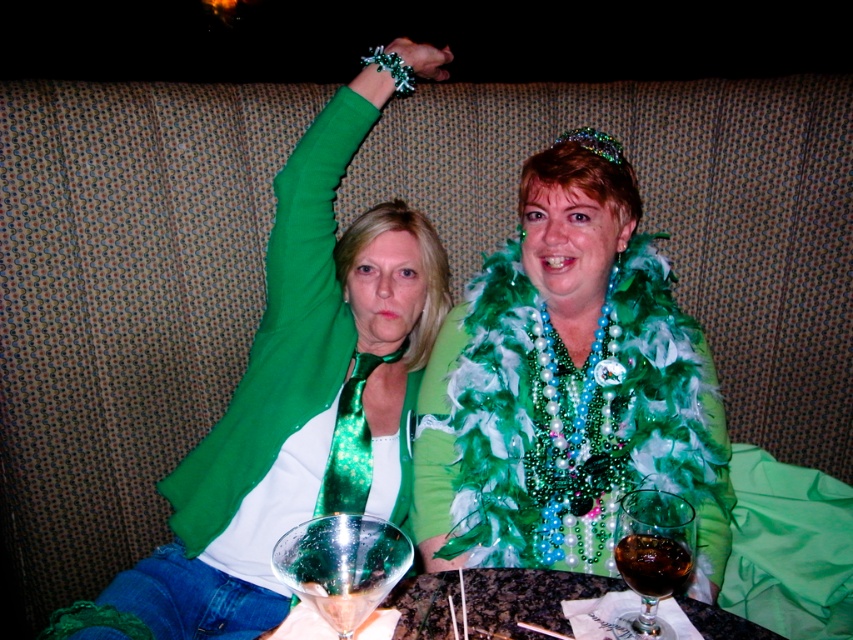
Between shiny green feather boa at center and translucent glass martini glass at center, which one has more height?

shiny green feather boa at center

Which is in front, point (485, 300) or point (326, 586)?

Point (326, 586) is in front.

At what (x,y) coordinates should I click in order to perform the action: click on shiny green feather boa at center. Please return your answer as a coordinate pair (x, y). The width and height of the screenshot is (853, 640). Looking at the image, I should click on (567, 384).

The height and width of the screenshot is (640, 853). Describe the element at coordinates (567, 384) in the screenshot. I see `shiny green feather boa at center` at that location.

Who is shorter, shiny green feather boa at center or transparent glass at lower right?

With less height is transparent glass at lower right.

The height and width of the screenshot is (640, 853). Find the location of `shiny green feather boa at center`. shiny green feather boa at center is located at coordinates (567, 384).

Does translucent glass martini glass at center appear over dark glass wine at lower center?

Correct, translucent glass martini glass at center is located above dark glass wine at lower center.

Which of these two, translucent glass martini glass at center or dark glass wine at lower center, stands shorter?

dark glass wine at lower center

Who is more forward, (285, 548) or (670, 582)?

Point (670, 582) is in front.

Where is `translucent glass martini glass at center`? Image resolution: width=853 pixels, height=640 pixels. translucent glass martini glass at center is located at coordinates (341, 564).